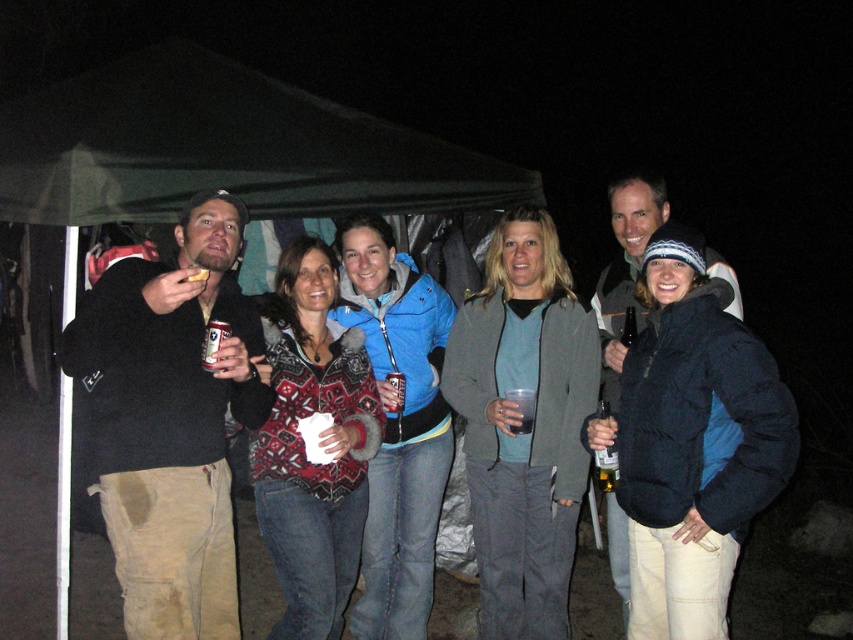
You are at a party and want to find the person wearing the dark blue puffy jacket at center. Which direction should you look relative to the person wearing the blue fleece jacket at center?

The dark blue puffy jacket at center is to the right of the blue fleece jacket at center, so you should look to the right of the person wearing the blue fleece jacket at center to find them.

You are a photographer trying to capture a group photo of the people in the image. You need to ensure that both the dark blue puffy jacket at center and the blue fleece jacket at center are in focus. Given that your camera has a depth of field that can cover 3 feet, will you be able to achieve this?

The distance between the dark blue puffy jacket at center and the blue fleece jacket at center is 3.50 feet. Since the camera can only cover 3 feet in depth of field, the two jackets will not both be in focus simultaneously.

You are a photographer trying to capture a clear shot of both the dark blue puffy jacket at center and the dark matte cup at center in the image. Given the low light conditions, you need to adjust your camera settings to ensure both subjects are in focus. Considering their sizes, which subject should you prioritize focusing on first?

The dark blue puffy jacket at center is much taller than the dark matte cup at center, so you should prioritize focusing on the dark blue puffy jacket at center first since it is larger and more prominent in the frame.